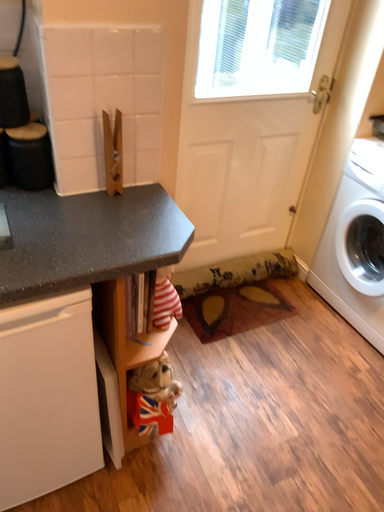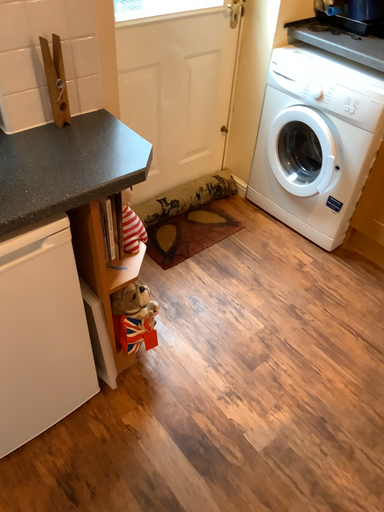
Question: Which way did the camera rotate in the video?

Choices:
 (A) rotated right
 (B) rotated left

Answer: (A)